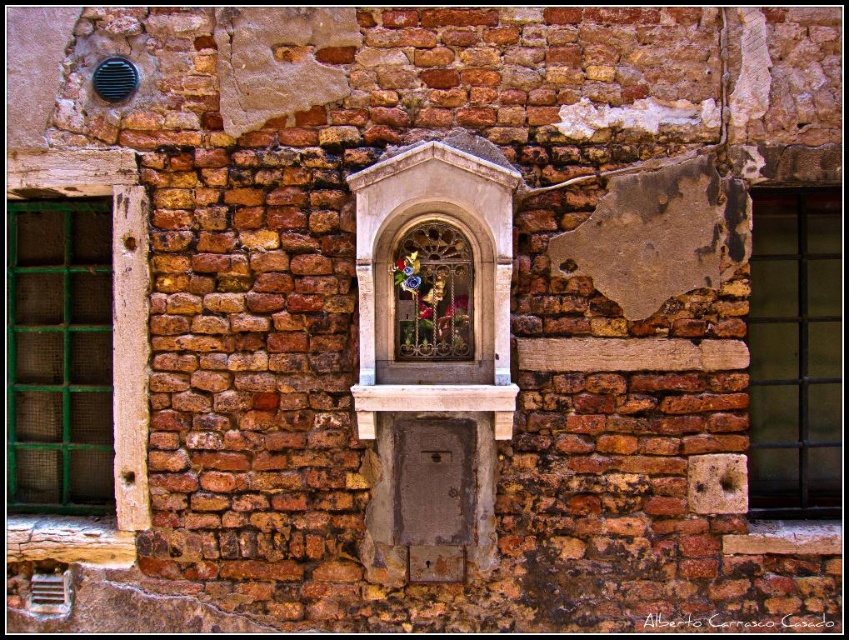
Who is shorter, green mesh window at left or black metal window at right?

With less height is green mesh window at left.

Is green mesh window at left taller than black metal window at right?

No.

Describe the element at coordinates (59, 356) in the screenshot. The width and height of the screenshot is (849, 640). I see `green mesh window at left` at that location.

Image resolution: width=849 pixels, height=640 pixels. I want to click on green mesh window at left, so tap(59, 356).